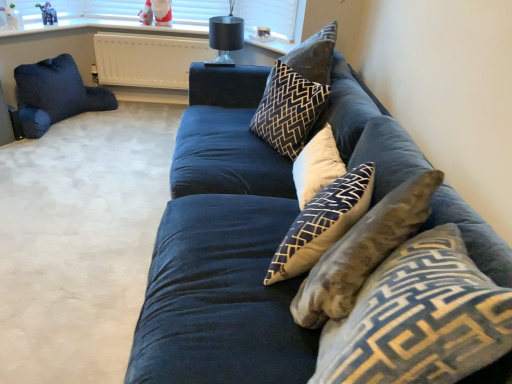
Measure the distance between point (59, 72) and camera.

Point (59, 72) is 3.08 meters away from camera.

In order to face dark blue velvet pillow at left, which is the fifth pillow from front to back, should I rotate leftwards or rightwards?

You should look left and rotate roughly 24.667 degrees.

Describe the element at coordinates (317, 166) in the screenshot. I see `white soft cushion at center, acting as the third pillow starting from the front` at that location.

Image resolution: width=512 pixels, height=384 pixels. What do you see at coordinates (13, 17) in the screenshot?
I see `white glossy figurine at upper left, which appears as the third toy when viewed from the back` at bounding box center [13, 17].

What is the approximate height of white glossy figurine at upper left, which is the 1th toy in front-to-back order?

white glossy figurine at upper left, which is the 1th toy in front-to-back order, is 6.60 inches tall.

Where is `navy blue fabric couch at center`? The width and height of the screenshot is (512, 384). navy blue fabric couch at center is located at coordinates (222, 250).

The image size is (512, 384). What are the coordinates of `dark blue fabric pillow at center, marked as the second pillow in a left-to-right arrangement` in the screenshot? It's located at (296, 94).

Does white matte radiator at upper center have a lesser width compared to dark blue fabric pillow at center, the fourth pillow when ordered from right to left?

Yes.

From the image's perspective, which is above, white matte radiator at upper center or dark blue fabric pillow at center, marked as the second pillow in a left-to-right arrangement?

white matte radiator at upper center, from the image's perspective.

Does white matte radiator at upper center turn towards dark blue fabric pillow at center, marked as the second pillow in a left-to-right arrangement?

Yes, white matte radiator at upper center is oriented towards dark blue fabric pillow at center, marked as the second pillow in a left-to-right arrangement.

Is white matte radiator at upper center looking in the opposite direction of matte plastic elephant at upper left, the second toy from the left?

No.

Considering the relative sizes of white matte radiator at upper center and matte plastic elephant at upper left, the 2th toy in the back-to-front sequence, in the image provided, is white matte radiator at upper center wider than matte plastic elephant at upper left, the 2th toy in the back-to-front sequence,?

Incorrect, the width of white matte radiator at upper center does not surpass that of matte plastic elephant at upper left, the 2th toy in the back-to-front sequence.

Which object is closer to the camera, white matte radiator at upper center or matte plastic elephant at upper left, marked as the second toy in a front-to-back arrangement?

Positioned in front is matte plastic elephant at upper left, marked as the second toy in a front-to-back arrangement.

Considering the sizes of white matte radiator at upper center and matte plastic elephant at upper left, the 2th toy in the back-to-front sequence, in the image, is white matte radiator at upper center bigger or smaller than matte plastic elephant at upper left, the 2th toy in the back-to-front sequence,?

In the image, white matte radiator at upper center appears to be larger than matte plastic elephant at upper left, the 2th toy in the back-to-front sequence.

Which is correct: blue velvet pillow at center, acting as the second pillow starting from the right, is inside navy blue fabric couch at center, or outside of it?

blue velvet pillow at center, acting as the second pillow starting from the right, is contained in navy blue fabric couch at center.

From the image's perspective, would you say blue velvet pillow at center, acting as the 1th pillow starting from the front, is shown under navy blue fabric couch at center?

Yes.

Considering the positions of points (464, 249) and (216, 306), is point (464, 249) closer to camera compared to point (216, 306)?

Yes.

Who is shorter, blue velvet pillow at center, which is the 5th pillow from back to front, or navy blue fabric couch at center?

blue velvet pillow at center, which is the 5th pillow from back to front, is shorter.

From a real-world perspective, who is located higher, black glass lamp at upper center or navy blue fabric couch at center?

black glass lamp at upper center is physically above.

Relative to navy blue fabric couch at center, is black glass lamp at upper center in front or behind?

Visually, black glass lamp at upper center is located behind navy blue fabric couch at center.

Looking at the image, does black glass lamp at upper center seem bigger or smaller compared to navy blue fabric couch at center?

black glass lamp at upper center is smaller than navy blue fabric couch at center.

From a real-world perspective, is blue velvet pillow at center, which is the 5th pillow from back to front, physically above matte plastic santa at upper center, which appears as the first toy when viewed from the right?

No, from a real-world perspective, blue velvet pillow at center, which is the 5th pillow from back to front, is not over matte plastic santa at upper center, which appears as the first toy when viewed from the right

From the image's perspective, would you say blue velvet pillow at center, acting as the second pillow starting from the right, is shown under matte plastic santa at upper center, which appears as the 1th toy when viewed from the back?

Yes, from the image's perspective, blue velvet pillow at center, acting as the second pillow starting from the right, is beneath matte plastic santa at upper center, which appears as the 1th toy when viewed from the back.

Who is taller, blue velvet pillow at center, which is counted as the fourth pillow, starting from the left, or matte plastic santa at upper center, which appears as the 1th toy when viewed from the back?

blue velvet pillow at center, which is counted as the fourth pillow, starting from the left, is taller.

Which of these two, blue velvet pillow at center, acting as the 1th pillow starting from the front, or matte plastic santa at upper center, which appears as the 1th toy when viewed from the back, is bigger?

With larger size is blue velvet pillow at center, acting as the 1th pillow starting from the front.

From a real-world perspective, is black glass lamp at upper center positioned above or below white glossy figurine at upper left, the 3th toy positioned from the right?

From a real-world perspective, black glass lamp at upper center is physically below white glossy figurine at upper left, the 3th toy positioned from the right.

Can you confirm if black glass lamp at upper center is wider than white glossy figurine at upper left, the 3th toy positioned from the right?

Yes.

How distant is black glass lamp at upper center from white glossy figurine at upper left, which appears as the third toy when viewed from the back?

The distance of black glass lamp at upper center from white glossy figurine at upper left, which appears as the third toy when viewed from the back, is 4.64 feet.

From the image's perspective, between black glass lamp at upper center and white glossy figurine at upper left, the 3th toy positioned from the right, which one is located above?

From the image's view, white glossy figurine at upper left, the 3th toy positioned from the right, is above.

Considering the sizes of objects dark blue fabric pillow at center, which is the 2th pillow in back-to-front order, and matte plastic elephant at upper left, the second toy from the left, in the image provided, who is smaller, dark blue fabric pillow at center, which is the 2th pillow in back-to-front order, or matte plastic elephant at upper left, the second toy from the left,?

matte plastic elephant at upper left, the second toy from the left, is smaller.

Is dark blue fabric pillow at center, which is the 2th pillow in back-to-front order, outside of matte plastic elephant at upper left, the second toy from the left?

Yes.

From the image's perspective, which is above, dark blue fabric pillow at center, the fourth pillow when ordered from right to left, or matte plastic elephant at upper left, the 2th toy in the back-to-front sequence?

matte plastic elephant at upper left, the 2th toy in the back-to-front sequence, appears higher in the image.

From a real-world perspective, does dark blue fabric pillow at center, which is the 2th pillow in back-to-front order, sit lower than matte plastic elephant at upper left, the second toy from the left?

Answer: Indeed, from a real-world perspective, dark blue fabric pillow at center, which is the 2th pillow in back-to-front order, is positioned beneath matte plastic elephant at upper left, the second toy from the left.

Locate an element on the screen. The height and width of the screenshot is (384, 512). pillow that is the 3rd object above the white matte radiator at upper center (from a real-world perspective) is located at coordinates (296, 94).

I want to click on radiator behind the matte plastic elephant at upper left, the 2th toy in the back-to-front sequence, so click(x=148, y=59).

When comparing their distances from white glossy figurine at upper left, which is the 1th toy in front-to-back order, does matte plastic elephant at upper left, the 2th toy viewed from the right, or matte plastic santa at upper center, the 3th toy when ordered from left to right, seem closer?

matte plastic elephant at upper left, the 2th toy viewed from the right.

Based on the photo, looking at the image, which one is located closer to dark blue velvet pillow at left, the 1th pillow from the left, white matte radiator at upper center or white soft cushion at center, acting as the 1th pillow starting from the right?

white matte radiator at upper center lies closer to dark blue velvet pillow at left, the 1th pillow from the left, than the other object.

When comparing their distances from dark blue velvet pillow at left, which is the fifth pillow from front to back, does white matte radiator at upper center or blue velvet pillow at center, acting as the 1th pillow starting from the front, seem closer?

Among the two, white matte radiator at upper center is located nearer to dark blue velvet pillow at left, which is the fifth pillow from front to back.

Considering their positions, is dark blue fabric pillow at center, which is the 2th pillow in back-to-front order, positioned closer to white cotton cushion at center, which is the second pillow from front to back, than black glass lamp at upper center?

dark blue fabric pillow at center, which is the 2th pillow in back-to-front order.

Based on their spatial positions, is white matte radiator at upper center or matte plastic elephant at upper left, the 2th toy viewed from the right, further from white cotton cushion at center, placed as the third pillow when sorted from right to left?

matte plastic elephant at upper left, the 2th toy viewed from the right, is positioned further to the anchor white cotton cushion at center, placed as the third pillow when sorted from right to left.

Which object lies further to the anchor point dark blue velvet pillow at left, which is the fifth pillow from front to back, white soft cushion at center, acting as the fifth pillow starting from the left, or blue velvet pillow at center, which is counted as the fourth pillow, starting from the left?

blue velvet pillow at center, which is counted as the fourth pillow, starting from the left, is positioned further to the anchor dark blue velvet pillow at left, which is the fifth pillow from front to back.

Estimate the real-world distances between objects in this image. Which object is closer to dark blue fabric pillow at center, which is the 2th pillow in back-to-front order, black glass lamp at upper center or white cotton cushion at center, placed as the third pillow when sorted from right to left?

The object closer to dark blue fabric pillow at center, which is the 2th pillow in back-to-front order, is white cotton cushion at center, placed as the third pillow when sorted from right to left.

When comparing their distances from navy blue fabric couch at center, does white soft cushion at center, which is the 3th pillow from back to front, or dark blue fabric pillow at center, marked as the second pillow in a left-to-right arrangement, seem closer?

The object closer to navy blue fabric couch at center is white soft cushion at center, which is the 3th pillow from back to front.

The width and height of the screenshot is (512, 384). In order to click on pillow between white glossy figurine at upper left, the 3th toy positioned from the right, and white matte radiator at upper center, in the horizontal direction in this screenshot , I will do 55,94.

Where is `lamp between dark blue fabric pillow at center, the fourth pillow viewed from the front, and matte plastic santa at upper center, which appears as the 1th toy when viewed from the back, from front to back`? The width and height of the screenshot is (512, 384). lamp between dark blue fabric pillow at center, the fourth pillow viewed from the front, and matte plastic santa at upper center, which appears as the 1th toy when viewed from the back, from front to back is located at coordinates (225, 37).

Locate an element on the screen. The width and height of the screenshot is (512, 384). radiator situated between matte plastic santa at upper center, the 3th toy when ordered from left to right, and black glass lamp at upper center from left to right is located at coordinates pos(148,59).

The image size is (512, 384). I want to click on toy between matte plastic elephant at upper left, the 2th toy in the back-to-front sequence, and dark blue fabric pillow at center, the fourth pillow viewed from the front, in the horizontal direction, so click(x=156, y=13).